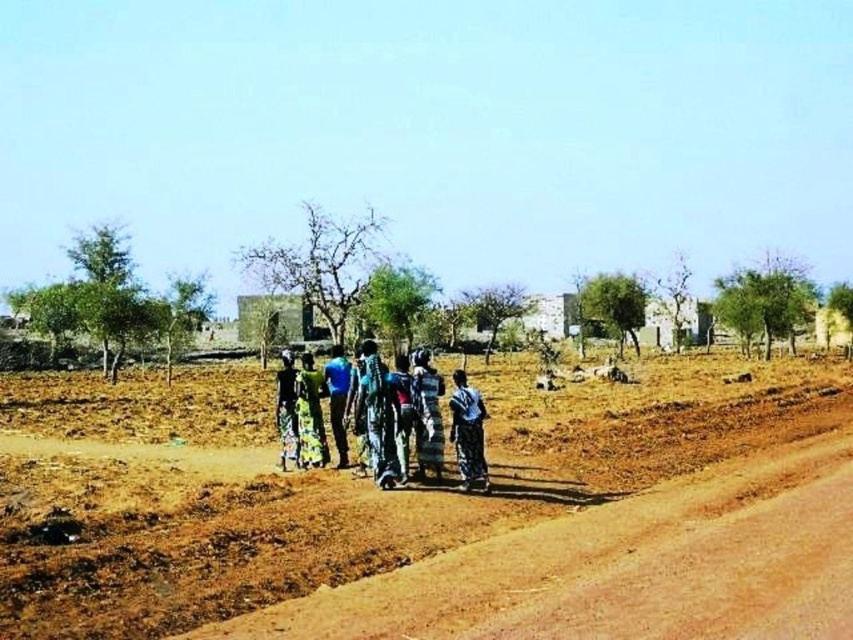
Does brown dirt field at center have a lesser height compared to light blue fabric at center?

Yes, brown dirt field at center is shorter than light blue fabric at center.

Which is above, brown dirt field at center or light blue fabric at center?

light blue fabric at center

Which is behind, point (132, 381) or point (473, 436)?

Point (132, 381)

You are a GUI agent. You are given a task and a screenshot of the screen. Output one action in this format:
    pyautogui.click(x=<x>, y=<y>)
    Task: Click on the brown dirt field at center
    This screenshot has width=853, height=640.
    Given the screenshot: What is the action you would take?
    pyautogui.click(x=345, y=483)

Is point (416, 362) in front of point (299, 384)?

Yes.

Can you confirm if textured fabric dress at center is positioned to the left of printed fabric dress at center?

No, textured fabric dress at center is not to the left of printed fabric dress at center.

You are a GUI agent. You are given a task and a screenshot of the screen. Output one action in this format:
    pyautogui.click(x=<x>, y=<y>)
    Task: Click on the textured fabric dress at center
    The width and height of the screenshot is (853, 640).
    Given the screenshot: What is the action you would take?
    pyautogui.click(x=427, y=413)

Looking at this image, does light blue fabric at center appear over dark green fabric at center?

Yes.

Is light blue fabric at center thinner than dark green fabric at center?

Indeed, light blue fabric at center has a lesser width compared to dark green fabric at center.

Who is more forward, (450,433) or (289,435)?

Point (450,433)

Find the location of a particular element. light blue fabric at center is located at coordinates (467, 432).